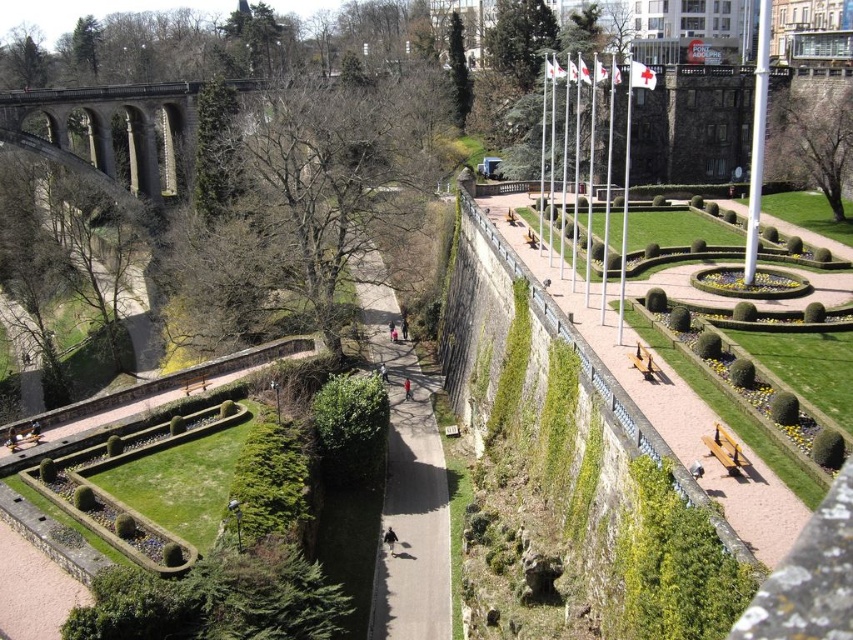
You are a gardener planning to trim both the green leafy tree at upper right and the green leafy hedge at center. Based on their sizes, which one will require more time to trim?

The green leafy tree at upper right requires more time to trim since it has a larger size compared to the green leafy hedge at center.

Consider the image. You are a gardener planning to trim both the green mossy hedge at lower right and the green leafy tree at upper right. Which of the two will require a ladder to reach its top?

The green leafy tree at upper right is taller than the green mossy hedge at lower right, so a ladder will be needed to reach its top.

In the scene shown: You are a gardener planning to trim the green leafy hedge at center and the brown stone bridge at upper left. Which object is closer to you from your current position in the park?

The brown stone bridge at upper left is closer to you than the green leafy hedge at center, which is positioned behind it.